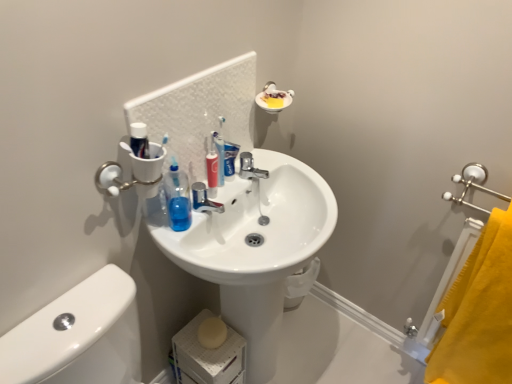
At what (x,y) coordinates should I click in order to perform the action: click on white glossy sink at center. Please return your answer as a coordinate pair (x, y). Image resolution: width=512 pixels, height=384 pixels. Looking at the image, I should click on (256, 248).

I want to click on translucent plastic toothbrush at center, so click(212, 167).

This screenshot has height=384, width=512. What do you see at coordinates (200, 111) in the screenshot?
I see `white textured mirror at upper center` at bounding box center [200, 111].

Locate an element on the screen. Image resolution: width=512 pixels, height=384 pixels. white glossy sink at center is located at coordinates (256, 248).

Considering the points (476, 272) and (230, 160), which point is in front, point (476, 272) or point (230, 160)?

The point (476, 272) is closer to the camera.

Is yellow fabric towel at right not close to white glossy toothpaste at center?

No, yellow fabric towel at right is in close proximity to white glossy toothpaste at center.

From the picture: Who is more distant, yellow fabric towel at right or white glossy toothpaste at center?

white glossy toothpaste at center is more distant.

Which object is positioned more to the right, yellow fabric towel at right or white glossy toothpaste at center?

yellow fabric towel at right is more to the right.

Considering the sizes of yellow fabric towel at right and translucent plastic toothbrush at center in the image, is yellow fabric towel at right bigger or smaller than translucent plastic toothbrush at center?

In the image, yellow fabric towel at right appears to be larger than translucent plastic toothbrush at center.

Could you tell me if yellow fabric towel at right is turned towards translucent plastic toothbrush at center?

No, yellow fabric towel at right does not turn towards translucent plastic toothbrush at center.

Is point (441, 379) closer to viewer compared to point (214, 164)?

No, (441, 379) is behind (214, 164).

Can you see yellow fabric towel at right touching translucent plastic toothbrush at center?

They are not placed beside each other.

Which of these two, white glossy sink at center or white glossy toothpaste at center, is bigger?

white glossy sink at center is bigger.

Where is `sink below the white glossy toothpaste at center (from the image's perspective)`? sink below the white glossy toothpaste at center (from the image's perspective) is located at coordinates (256, 248).

From a real-world perspective, which is physically above, white glossy sink at center or white glossy toothpaste at center?

From a 3D spatial view, white glossy toothpaste at center is above.

Could you tell me if white glossy sink at center is turned towards white glossy toothpaste at center?

No, white glossy sink at center is not turned towards white glossy toothpaste at center.

Does yellow fabric towel at right have a smaller size compared to white textured mirror at upper center?

Incorrect, yellow fabric towel at right is not smaller in size than white textured mirror at upper center.

Find the location of `bath towel that appears in front of the white textured mirror at upper center`. bath towel that appears in front of the white textured mirror at upper center is located at coordinates (479, 313).

From a real-world perspective, which is physically above, yellow fabric towel at right or white textured mirror at upper center?

A: In real-world perspective, white textured mirror at upper center is above.

Between point (473, 359) and point (245, 147), which one is positioned in front?

The point (473, 359) is more forward.

Is white glossy toothpaste at center outside of translucent plastic toothbrush at center?

white glossy toothpaste at center lies outside translucent plastic toothbrush at center's area.

Is point (231, 158) closer to camera compared to point (214, 197)?

That is False.

Based on their positions, is white glossy toothpaste at center located to the left or right of translucent plastic toothbrush at center?

Based on their positions, white glossy toothpaste at center is located to the right of translucent plastic toothbrush at center.

How many degrees apart are the facing directions of white glossy toothpaste at center and translucent plastic toothbrush at center?

The angular difference between white glossy toothpaste at center and translucent plastic toothbrush at center is 4.17 degrees.

Would you say white glossy sink at center is to the left or to the right of translucent plastic toothbrush at center in the picture?

In the image, white glossy sink at center appears on the right side of translucent plastic toothbrush at center.

From a real-world perspective, which object stands above the other?

translucent plastic toothbrush at center, from a real-world perspective.

Does white glossy sink at center have a lesser width compared to translucent plastic toothbrush at center?

No.

How distant is white glossy sink at center from translucent plastic toothbrush at center?

white glossy sink at center is 30.09 centimeters away from translucent plastic toothbrush at center.

How many degrees apart are the facing directions of white glossy toothpaste at center and yellow fabric towel at right?

The angle between the facing direction of white glossy toothpaste at center and the facing direction of yellow fabric towel at right is 92.8 degrees.

Who is taller, white glossy toothpaste at center or yellow fabric towel at right?

With more height is yellow fabric towel at right.

Considering the positions of objects white glossy toothpaste at center and yellow fabric towel at right in the image provided, who is behind, white glossy toothpaste at center or yellow fabric towel at right?

Positioned behind is white glossy toothpaste at center.

From the image's perspective, which one is positioned higher, white glossy toothpaste at center or yellow fabric towel at right?

white glossy toothpaste at center.

You are a GUI agent. You are given a task and a screenshot of the screen. Output one action in this format:
    pyautogui.click(x=<x>, y=<y>)
    Task: Click on the bath towel on the right side of white glossy toothpaste at center
    The height and width of the screenshot is (384, 512).
    Given the screenshot: What is the action you would take?
    pyautogui.click(x=479, y=313)

Image resolution: width=512 pixels, height=384 pixels. What are the coordinates of `cleaning product behind the yellow fabric towel at right` in the screenshot? It's located at (212, 167).

From the image, which object appears to be nearer to white glossy toothpaste at center, translucent plastic toothbrush at center or white textured mirror at upper center?

The object closer to white glossy toothpaste at center is translucent plastic toothbrush at center.

Estimate the real-world distances between objects in this image. Which object is further from white textured mirror at upper center, white glossy toothpaste at center or yellow fabric towel at right?

yellow fabric towel at right lies further to white textured mirror at upper center than the other object.

From the picture: From the image, which object appears to be nearer to white glossy toothpaste at center, yellow fabric towel at right or white glossy sink at center?

white glossy sink at center is positioned closer to the anchor white glossy toothpaste at center.

Which object lies further to the anchor point yellow fabric towel at right, white glossy toothpaste at center or white textured mirror at upper center?

white textured mirror at upper center is positioned further to the anchor yellow fabric towel at right.

Estimate the real-world distances between objects in this image. Which object is closer to white glossy toothpaste at center, white textured mirror at upper center or translucent plastic toothbrush at center?

translucent plastic toothbrush at center is closer to white glossy toothpaste at center.

When comparing their distances from yellow fabric towel at right, does white glossy sink at center or translucent plastic toothbrush at center seem closer?

Among the two, white glossy sink at center is located nearer to yellow fabric towel at right.

From the image, which object appears to be farther from white textured mirror at upper center, translucent plastic toothbrush at center or white glossy toothpaste at center?

white glossy toothpaste at center is further to white textured mirror at upper center.

Estimate the real-world distances between objects in this image. Which object is further from translucent plastic toothbrush at center, white textured mirror at upper center or white glossy sink at center?

The object further to translucent plastic toothbrush at center is white glossy sink at center.

What are the coordinates of `toothpaste located between white textured mirror at upper center and yellow fabric towel at right in the left-right direction` in the screenshot? It's located at (230, 159).

At what (x,y) coordinates should I click in order to perform the action: click on cleaning product between white textured mirror at upper center and white glossy toothpaste at center in the front-back direction. Please return your answer as a coordinate pair (x, y). Looking at the image, I should click on click(x=212, y=167).

Identify the location of cleaning product between white textured mirror at upper center and white glossy sink at center vertically. The height and width of the screenshot is (384, 512). (212, 167).

Find the location of a particular element. sink between white textured mirror at upper center and yellow fabric towel at right is located at coordinates pos(256,248).